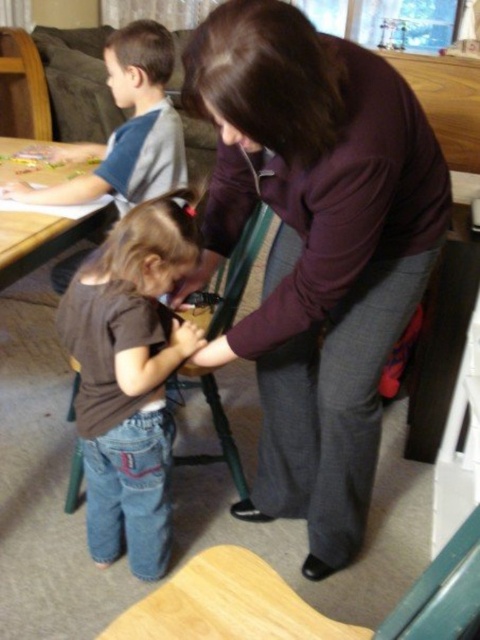
You are standing in the living room and need to place a small plant pot at the exact location where the brown denim jeans at lower left are currently located. What are the coordinates of that location?

The coordinates of the brown denim jeans at lower left are at point (130, 378).